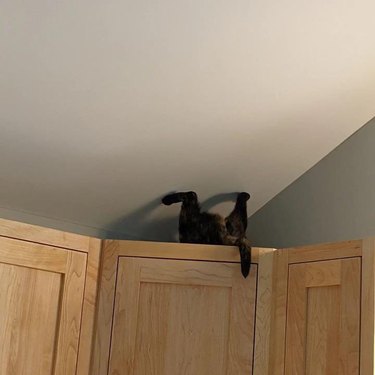
Where is `wood pattern`? The image size is (375, 375). wood pattern is located at coordinates (106, 257).